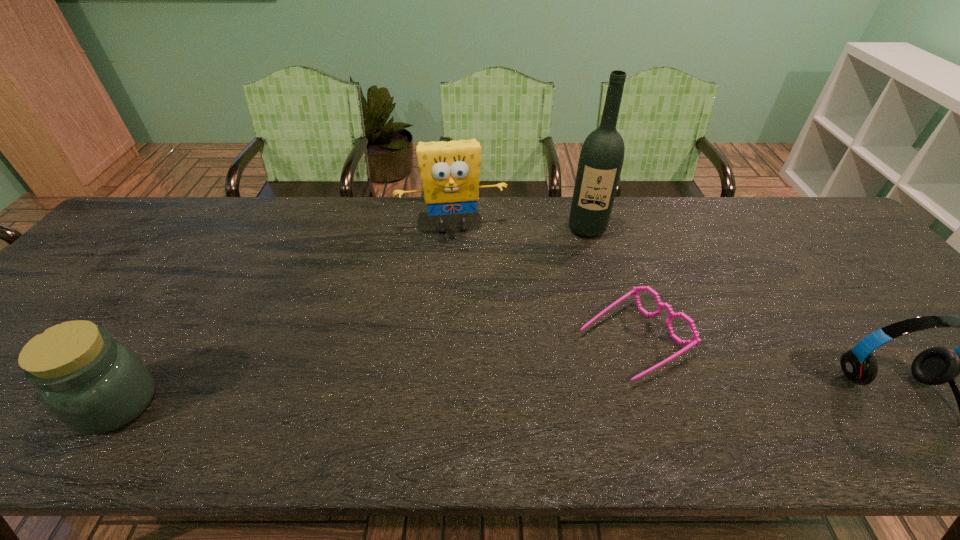
Find the location of a particular element. object that is the closest to the sponge is located at coordinates (602, 154).

Point out which object is positioned as the third nearest to the leftmost object. Please provide its 2D coordinates. Your answer should be formatted as a tuple, i.e. [(x, y)], where the tuple contains the x and y coordinates of a point satisfying the conditions above.

[(602, 154)]

Where is `free spot that satisfies the following two spatial constraints: 1. on the back side of the leftmost object; 2. on the right side of the second object from left to right`? This screenshot has width=960, height=540. free spot that satisfies the following two spatial constraints: 1. on the back side of the leftmost object; 2. on the right side of the second object from left to right is located at coordinates (233, 227).

The width and height of the screenshot is (960, 540). I want to click on vacant point that satisfies the following two spatial constraints: 1. on the front side of the shortest object; 2. on the left side of the tallest object, so click(618, 340).